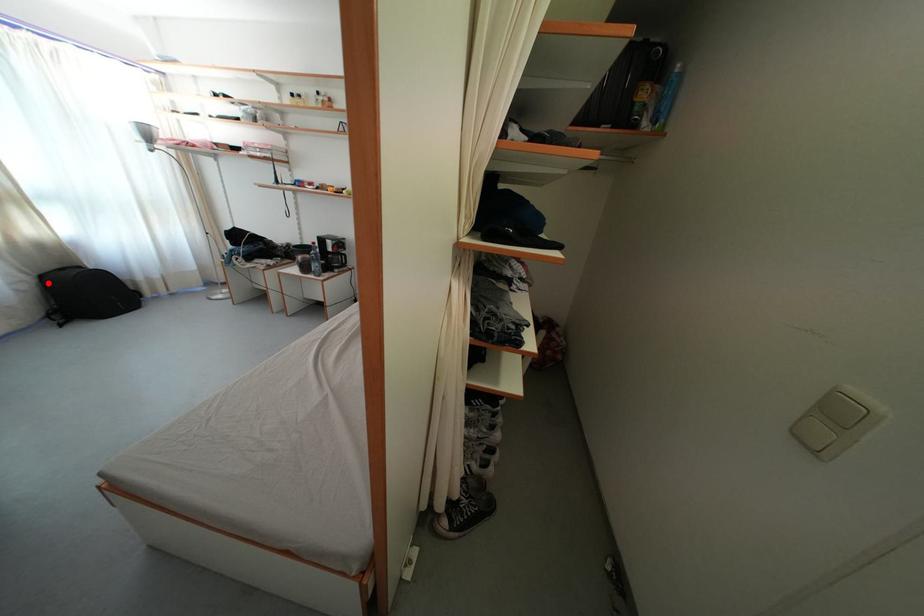
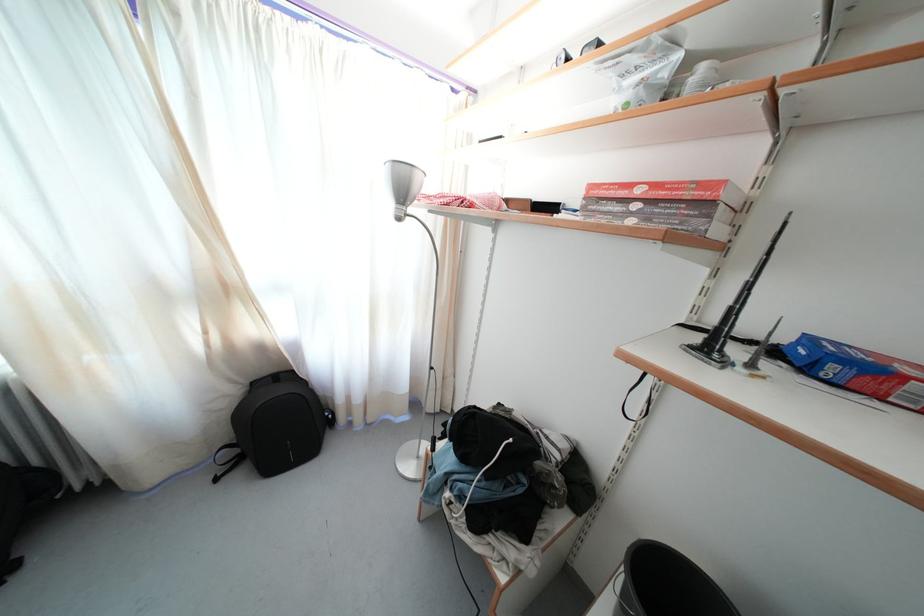
In the second image, find the point that corresponds to the highlighted location in the first image.

(259, 390)